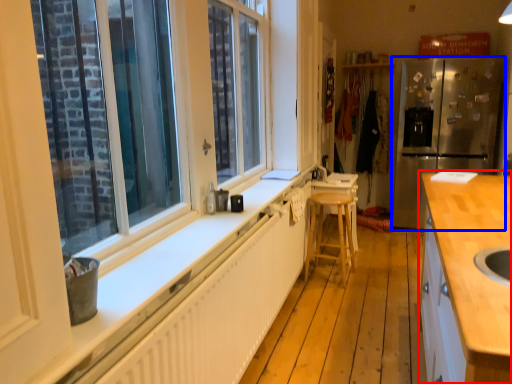
Question: Which point is further to the camera, cabinetry (highlighted by a red box) or refrigerator (highlighted by a blue box)?

Choices:
 (A) cabinetry
 (B) refrigerator

Answer: (B)